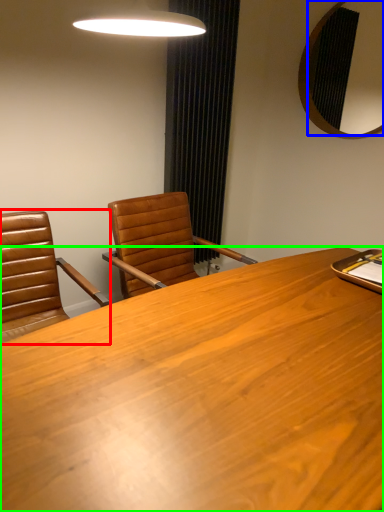
Question: Which object is positioned farthest from chair (highlighted by a red box)? Select from mirror (highlighted by a blue box) and desk (highlighted by a green box).

Choices:
 (A) mirror
 (B) desk

Answer: (A)